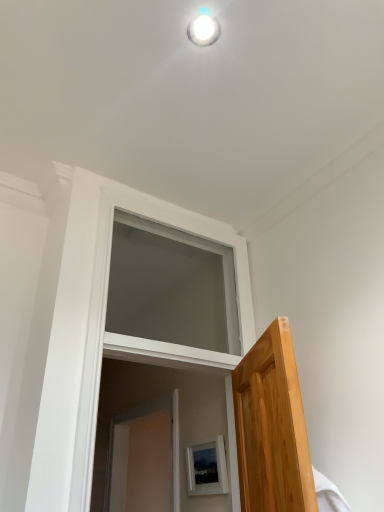
Question: Considering the relative sizes of matte white picture frame at lower center and white glossy light fixture at upper center in the image provided, is matte white picture frame at lower center shorter than white glossy light fixture at upper center?

Choices:
 (A) yes
 (B) no

Answer: (B)

Question: Does matte white picture frame at lower center have a lesser width compared to white glossy light fixture at upper center?

Choices:
 (A) no
 (B) yes

Answer: (B)

Question: Is matte white picture frame at lower center touching white glossy light fixture at upper center?

Choices:
 (A) yes
 (B) no

Answer: (B)

Question: Is matte white picture frame at lower center in front of white glossy light fixture at upper center?

Choices:
 (A) no
 (B) yes

Answer: (A)

Question: Does matte white picture frame at lower center lie behind white glossy light fixture at upper center?

Choices:
 (A) no
 (B) yes

Answer: (B)

Question: Does matte white picture frame at lower center appear on the right side of white glossy light fixture at upper center?

Choices:
 (A) no
 (B) yes

Answer: (B)

Question: Is white glossy light fixture at upper center aimed at white matte window at center?

Choices:
 (A) no
 (B) yes

Answer: (A)

Question: From a real-world perspective, is white glossy light fixture at upper center on top of white matte window at center?

Choices:
 (A) no
 (B) yes

Answer: (B)

Question: Does white glossy light fixture at upper center have a lesser width compared to white matte window at center?

Choices:
 (A) no
 (B) yes

Answer: (B)

Question: Is white glossy light fixture at upper center not inside white matte window at center?

Choices:
 (A) no
 (B) yes

Answer: (B)

Question: From the image's perspective, is white glossy light fixture at upper center located beneath white matte window at center?

Choices:
 (A) yes
 (B) no

Answer: (B)

Question: Does white glossy light fixture at upper center have a greater width compared to white matte window at center?

Choices:
 (A) yes
 (B) no

Answer: (B)

Question: Is matte white picture frame at lower center bigger than white matte window at center?

Choices:
 (A) yes
 (B) no

Answer: (B)